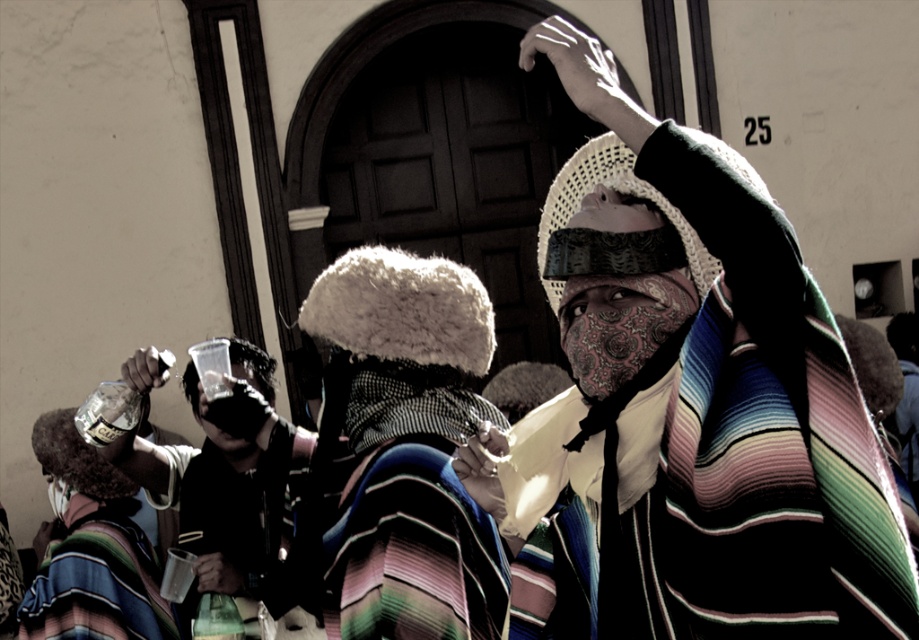
Describe the element at coordinates (404, 513) in the screenshot. I see `striped woolen shawl at center` at that location.

Is striped woolen shawl at center bigger than striped woolen robe at center?

No, striped woolen shawl at center is not bigger than striped woolen robe at center.

Identify the location of striped woolen shawl at center. [404, 513].

Who is more forward, (227, 579) or (139, 362)?

Point (139, 362) is more forward.

Does translucent plastic cup at upper center lie in front of metallic silver cup at lower left?

That is True.

Is point (191, 380) closer to viewer compared to point (146, 381)?

No, it is not.

Find the location of a particular element. This screenshot has height=640, width=919. translucent plastic cup at upper center is located at coordinates (218, 492).

Between striped woolen shawl at center and striped woolen robe at lower left, which one appears on the right side from the viewer's perspective?

Positioned to the right is striped woolen shawl at center.

Describe the element at coordinates (404, 513) in the screenshot. I see `striped woolen shawl at center` at that location.

Identify the location of striped woolen shawl at center. (404, 513).